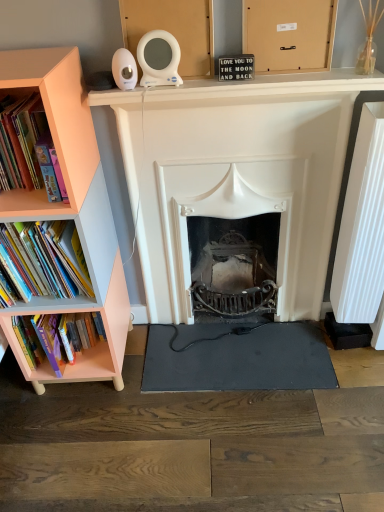
Question: From the image's perspective, does peach wood bookshelf at left appear higher than peach wood bookcase at left?

Choices:
 (A) no
 (B) yes

Answer: (A)

Question: Does peach wood bookshelf at left have a lesser height compared to peach wood bookcase at left?

Choices:
 (A) no
 (B) yes

Answer: (B)

Question: Is peach wood bookshelf at left to the right of peach wood bookcase at left from the viewer's perspective?

Choices:
 (A) yes
 (B) no

Answer: (A)

Question: From the image's perspective, is peach wood bookshelf at left under peach wood bookcase at left?

Choices:
 (A) no
 (B) yes

Answer: (B)

Question: Would you consider peach wood bookshelf at left to be distant from peach wood bookcase at left?

Choices:
 (A) no
 (B) yes

Answer: (A)

Question: Relative to pink matte bookshelf at left, is hardcover books at left in front or behind?

Choices:
 (A) front
 (B) behind

Answer: (B)

Question: Considering the relative positions of hardcover books at left and pink matte bookshelf at left in the image provided, is hardcover books at left to the left or to the right of pink matte bookshelf at left?

Choices:
 (A) right
 (B) left

Answer: (A)

Question: In terms of height, does hardcover books at left look taller or shorter compared to pink matte bookshelf at left?

Choices:
 (A) short
 (B) tall

Answer: (A)

Question: From the image's perspective, is hardcover books at left positioned above or below pink matte bookshelf at left?

Choices:
 (A) below
 (B) above

Answer: (A)

Question: Would you say white matte fireplace at center is to the left or to the right of black rubber yoga mat at center in the picture?

Choices:
 (A) left
 (B) right

Answer: (A)

Question: In the image, is white matte fireplace at center positioned in front of or behind black rubber yoga mat at center?

Choices:
 (A) front
 (B) behind

Answer: (A)

Question: Considering the positions of white matte fireplace at center and black rubber yoga mat at center in the image, is white matte fireplace at center wider or thinner than black rubber yoga mat at center?

Choices:
 (A) thin
 (B) wide

Answer: (A)

Question: Is point (180, 189) positioned closer to the camera than point (236, 370)?

Choices:
 (A) closer
 (B) farther

Answer: (A)

Question: Is point (76, 211) positioned closer to the camera than point (115, 351)?

Choices:
 (A) farther
 (B) closer

Answer: (B)

Question: From a real-world perspective, is pink matte bookshelf at left positioned above or below peach wood bookshelf at left?

Choices:
 (A) above
 (B) below

Answer: (A)